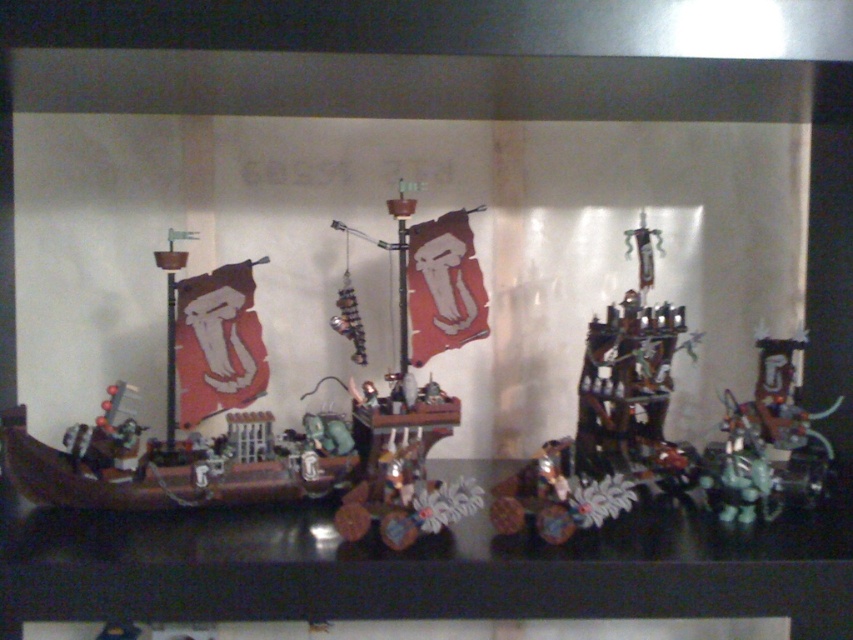
You are an appraiser examining the miniature ships displayed on a table. You notice two points marked on the table at coordinates point (376, 243) and point (640, 358). Which point is closer to you as you face the display?

Point (640, 358) is closer to you because point (376, 243) is behind it.